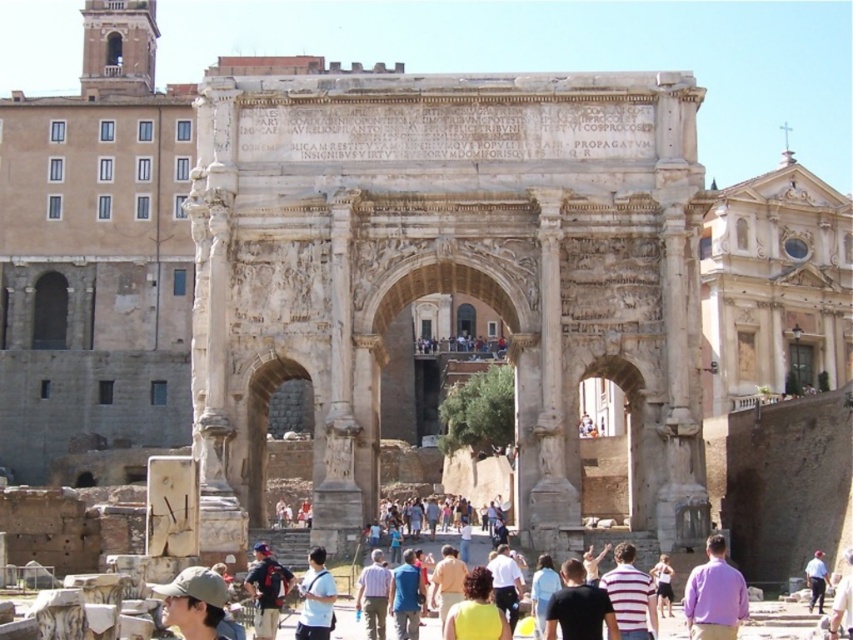
Question: Is purple cotton shirt at center closer to camera compared to white matte shirt at center?

Choices:
 (A) no
 (B) yes

Answer: (B)

Question: Estimate the real-world distances between objects in this image. Which object is farther from the khaki fabric cap at lower left?

Choices:
 (A) light blue shirt at center
 (B) purple cotton shirt at center
 (C) white matte shirt at center
 (D) matte black backpack at lower left

Answer: (A)

Question: Among these points, which one is farthest from the camera?

Choices:
 (A) (186, 611)
 (B) (737, 588)
 (C) (271, 589)

Answer: (C)

Question: Is black t-shirt at center thinner than white matte shirt at center?

Choices:
 (A) yes
 (B) no

Answer: (A)

Question: Which of the following is the closest to the observer?

Choices:
 (A) light blue shirt at center
 (B) khaki fabric cap at lower left
 (C) striped shirt at center

Answer: (B)

Question: Is white matte shirt at center above light blue shirt at center?

Choices:
 (A) yes
 (B) no

Answer: (A)